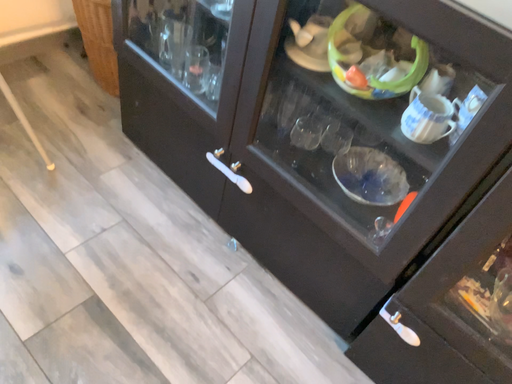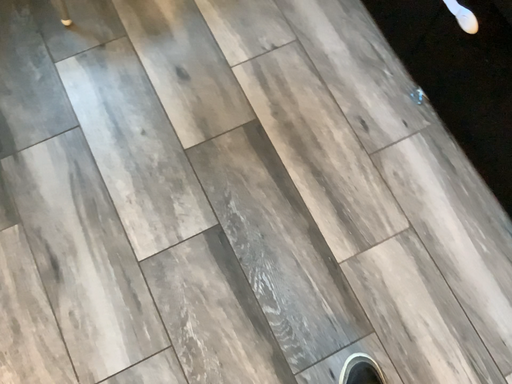
Question: Which way did the camera rotate in the video?

Choices:
 (A) rotated right
 (B) rotated left

Answer: (B)